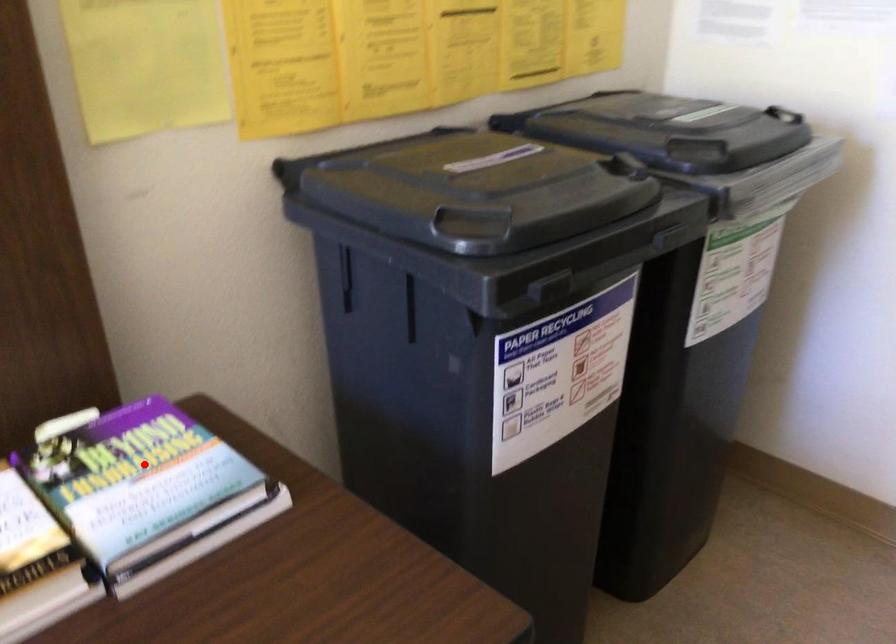
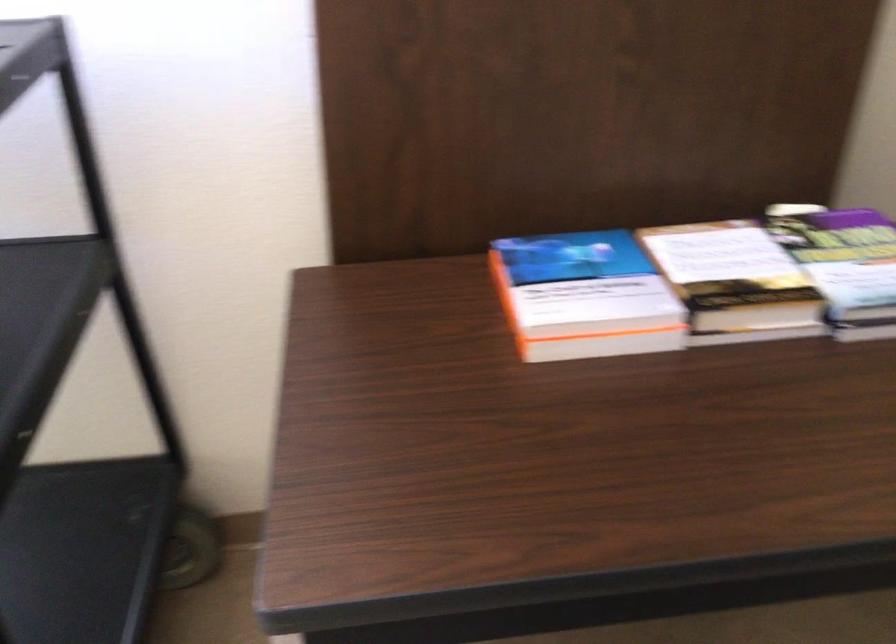
Question: I am providing you with two images of the same scene from different viewpoints. Image1 has a red point marked. In image2, the corresponding 3D location appears at what relative position? Reply with the corresponding letter.

Choices:
 (A) Closer
 (B) Farther

Answer: (B)